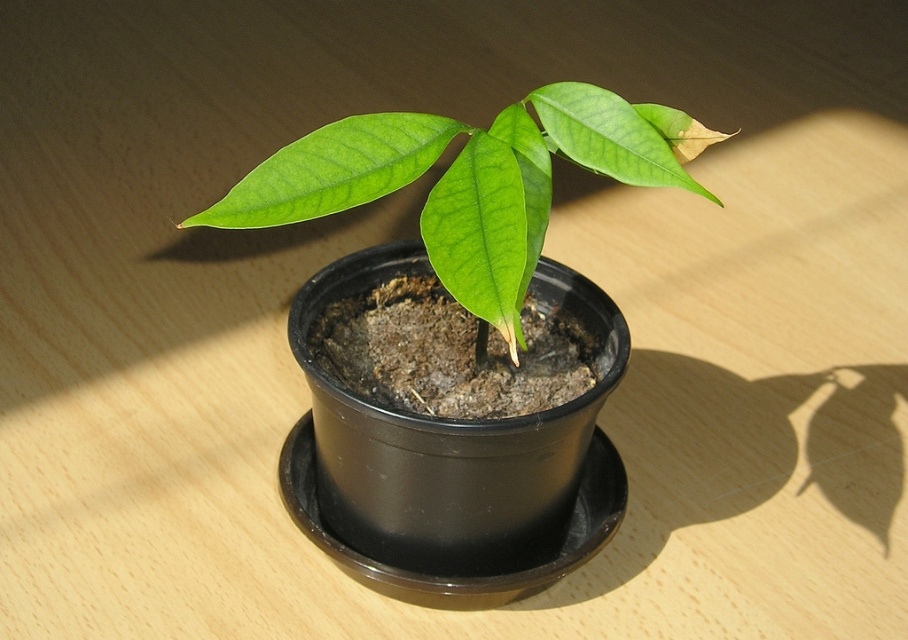
Who is lower down, green glossy leaf at center or green matte leaf at upper center?

green glossy leaf at center is below.

Is green glossy leaf at center shorter than green matte leaf at upper center?

No.

Measure the distance between point (435, 186) and camera.

Point (435, 186) is 34.13 inches away from camera.

Where is `green glossy leaf at center`? The width and height of the screenshot is (908, 640). green glossy leaf at center is located at coordinates (480, 234).

Is green matte leaf at center smaller than green matte leaf at upper center?

No.

The height and width of the screenshot is (640, 908). What do you see at coordinates (332, 170) in the screenshot?
I see `green matte leaf at center` at bounding box center [332, 170].

Where is `green matte leaf at center`? The width and height of the screenshot is (908, 640). green matte leaf at center is located at coordinates pyautogui.click(x=332, y=170).

Where is `green matte leaf at center`? Image resolution: width=908 pixels, height=640 pixels. green matte leaf at center is located at coordinates (332, 170).

Is green matte leaf at center positioned before green glossy leaf at center?

No, it is not.

Measure the distance between point (x=360, y=154) and camera.

Point (x=360, y=154) and camera are 35.04 inches apart from each other.

Where is `green matte leaf at center`? green matte leaf at center is located at coordinates (332, 170).